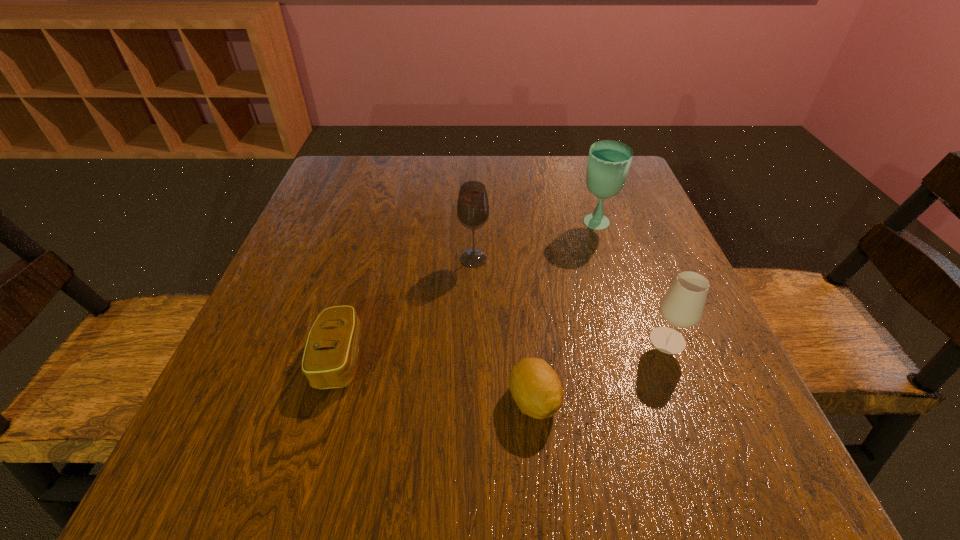
This screenshot has height=540, width=960. I want to click on vacant space at the near right corner, so click(x=692, y=503).

At what (x,y) coordinates should I click in order to perform the action: click on empty location between the farthest glass and the third object from right to left. Please return your answer as a coordinate pair (x, y). This screenshot has width=960, height=540. Looking at the image, I should click on tap(564, 312).

Find the location of a particular element. This screenshot has height=540, width=960. empty location between the clutch bag and the lemon is located at coordinates point(437,379).

In order to click on empty space between the lemon and the farthest glass in this screenshot , I will do `click(564, 312)`.

Locate an element on the screen. vacant area between the farthest object and the clutch bag is located at coordinates (468, 291).

Locate an element on the screen. vacant region between the third object from right to left and the leftmost object is located at coordinates (437, 379).

Find the location of a particular element. This screenshot has width=960, height=540. free area in between the farthest glass and the lemon is located at coordinates (564, 312).

This screenshot has width=960, height=540. I want to click on free point between the clutch bag and the shortest glass, so click(504, 349).

This screenshot has height=540, width=960. I want to click on free space between the third object from right to left and the farthest glass, so click(x=564, y=312).

I want to click on free space between the leftmost object and the lemon, so click(437, 379).